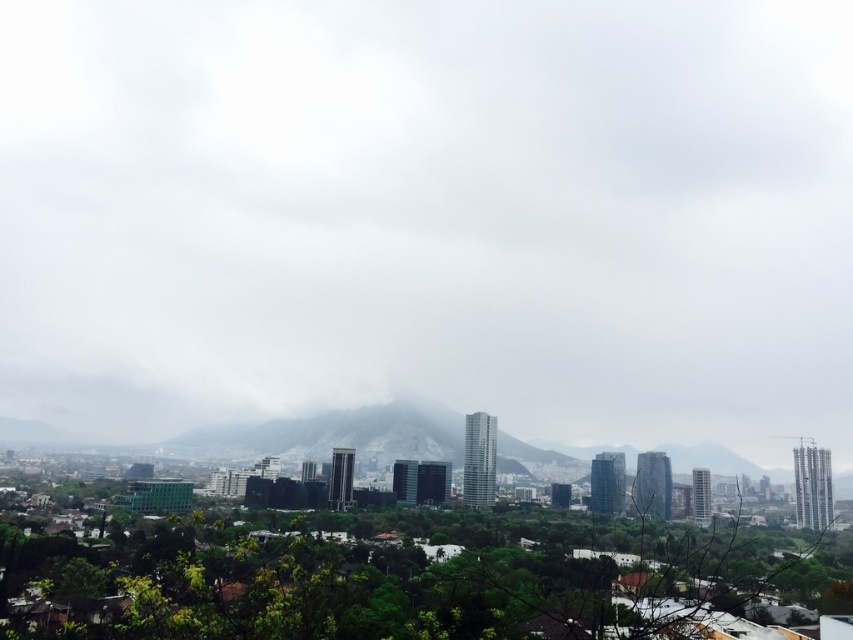
Does point (421, 310) come farther from viewer compared to point (436, 435)?

No, (421, 310) is in front of (436, 435).

Which is below, white fluffy cloud at center or gray foggy mountain at center?

Positioned lower is gray foggy mountain at center.

Which is in front, point (805, 422) or point (166, 451)?

Point (166, 451) is more forward.

You are a GUI agent. You are given a task and a screenshot of the screen. Output one action in this format:
    pyautogui.click(x=<x>, y=<y>)
    Task: Click on the white fluffy cloud at center
    The width and height of the screenshot is (853, 640).
    Given the screenshot: What is the action you would take?
    pyautogui.click(x=430, y=214)